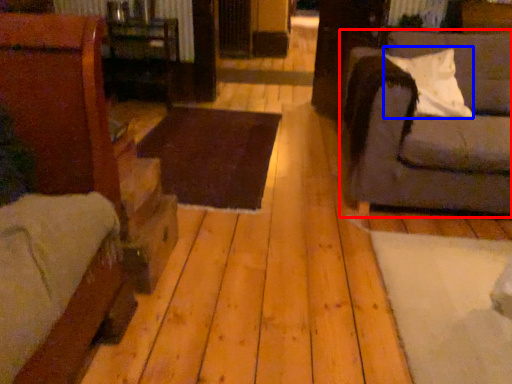
Question: Which object appears farthest to the camera in this image, studio couch (highlighted by a red box) or pillow (highlighted by a blue box)?

Choices:
 (A) studio couch
 (B) pillow

Answer: (B)